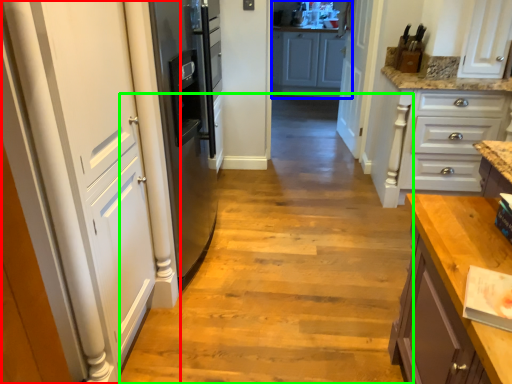
Question: Which is farther away from door (highlighted by a red box)? cabinetry (highlighted by a blue box) or path (highlighted by a green box)?

Choices:
 (A) cabinetry
 (B) path

Answer: (A)